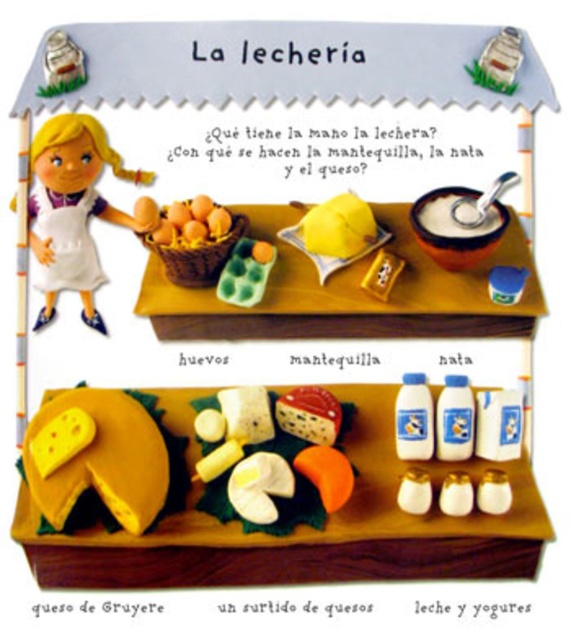
Question: Which point is farther to the camera?

Choices:
 (A) yellow cheese at center
 (B) white plastic milk jug at upper left
 (C) white crumbly cheese at center
 (D) smooth orange eggs at center

Answer: (D)

Question: Can you confirm if white glossy doll at upper left is positioned to the right of smooth orange eggs at center?

Choices:
 (A) no
 (B) yes

Answer: (A)

Question: Which object is farther from the camera taking this photo?

Choices:
 (A) smooth orange eggs at center
 (B) yellow cheese at center
 (C) white glossy doll at upper left

Answer: (A)

Question: Considering the relative positions of yellow cheese at center and green plastic eggs at center in the image provided, where is yellow cheese at center located with respect to green plastic eggs at center?

Choices:
 (A) above
 (B) below

Answer: (B)

Question: Is yellow matte lemon at center to the right of smooth orange eggs at center from the viewer's perspective?

Choices:
 (A) no
 (B) yes

Answer: (B)

Question: Which object is the closest to the white plastic milk jug at upper left?

Choices:
 (A) yellow matte lemon at center
 (B) white glossy doll at upper left

Answer: (B)